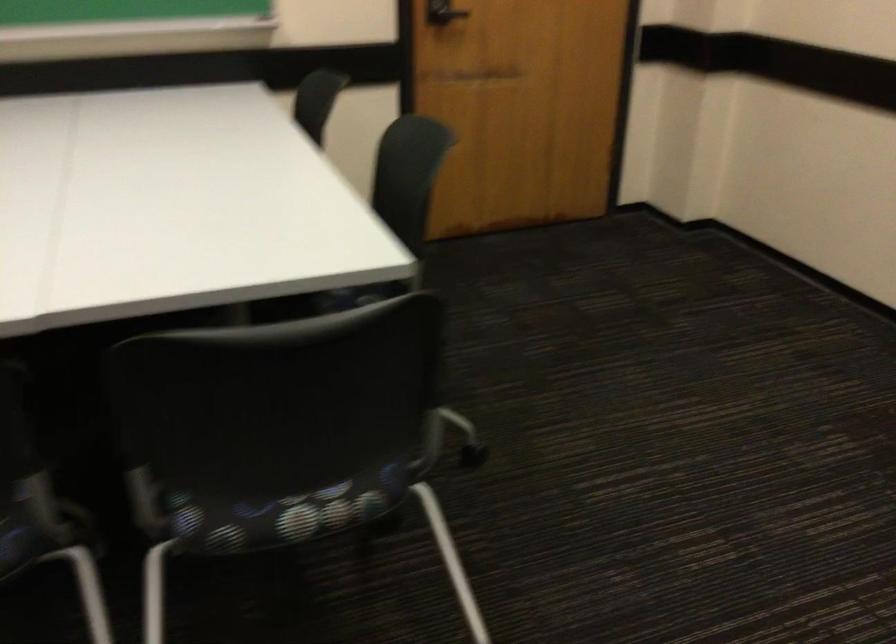
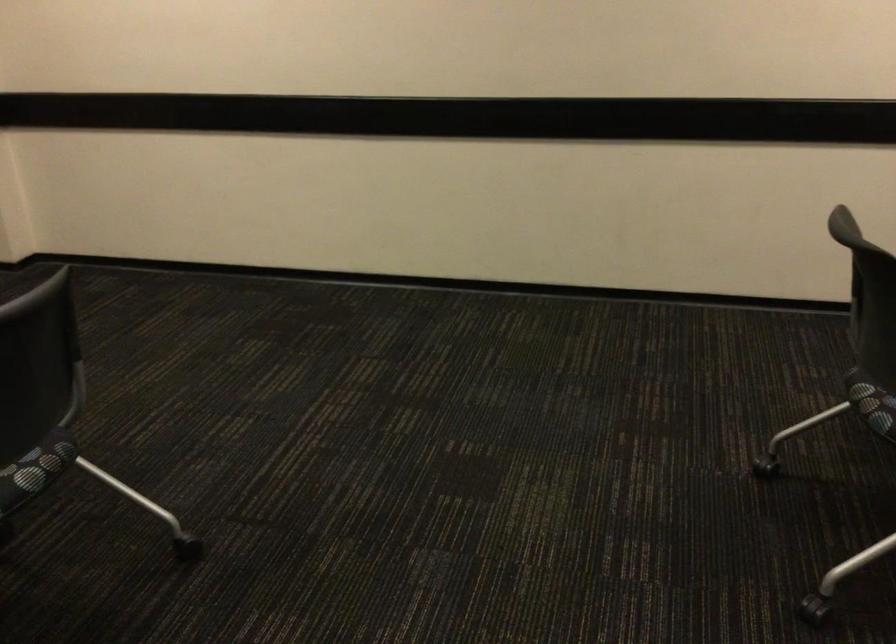
Find the pixel in the second image that matches [320,509] in the first image.

(40, 462)